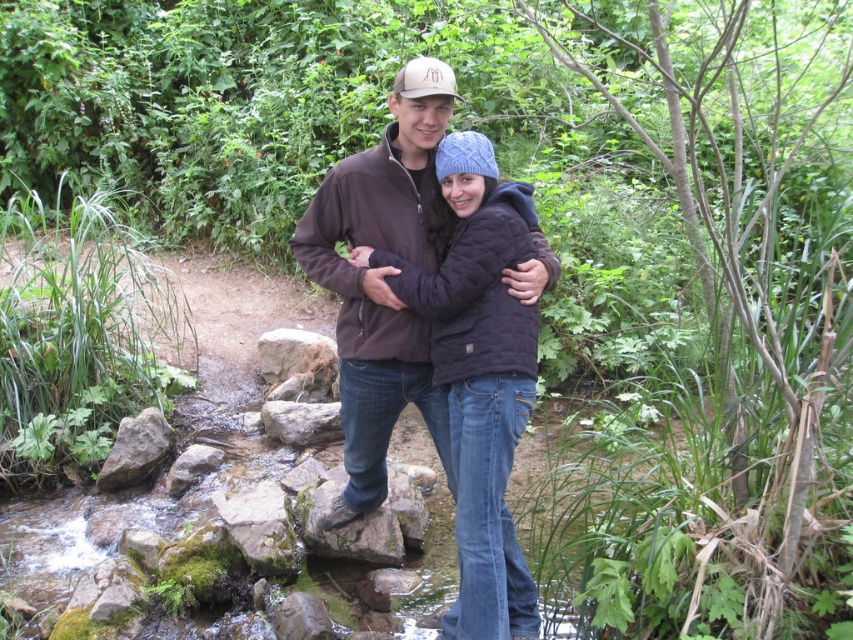
You are a photographer trying to capture a candid shot of the two people in the forest. You notice the rocky stone at center and the matte brown baseball cap at upper center. Which object is positioned to the left of the other?

The rocky stone at center is to the left of the matte brown baseball cap at upper center according to the description.

You are a hiker trying to place a small item between the rocky stone at center and the mossy rock at center. Which rock should you place it closer to in order for it to be visible from your current viewpoint?

You should place the item closer to the rocky stone at center because it is closer to you than the mossy rock at center, making it more visible from your current viewpoint.